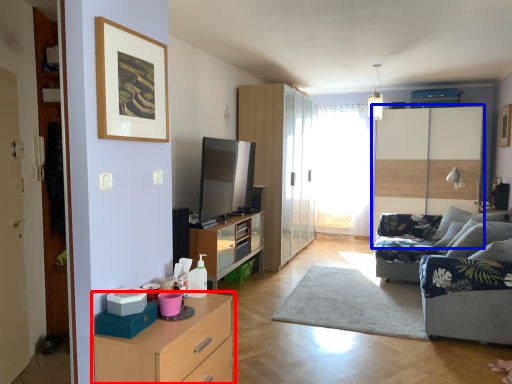
Question: Which object appears farthest to the camera in this image, chest of drawers (highlighted by a red box) or dresser (highlighted by a blue box)?

Choices:
 (A) chest of drawers
 (B) dresser

Answer: (B)